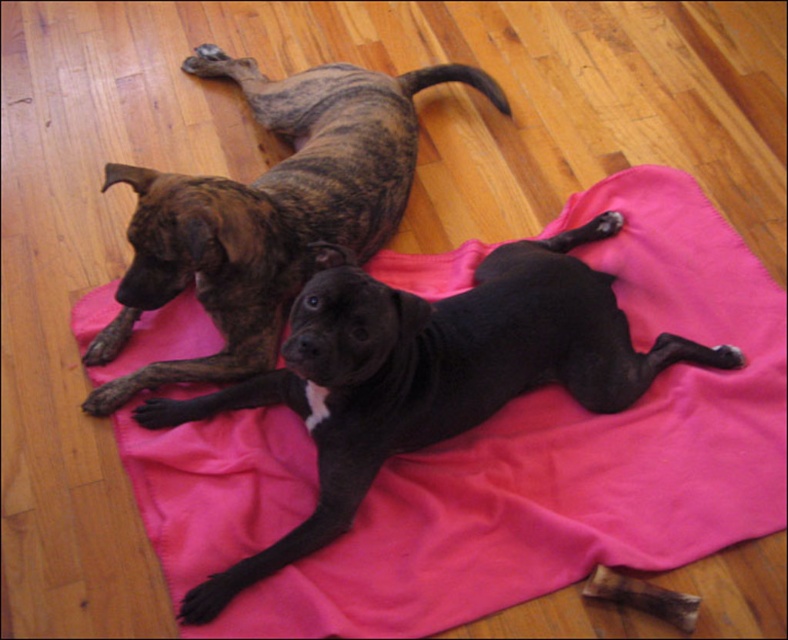
Question: Is black smooth dog at center above brindle fur dog at upper left?

Choices:
 (A) yes
 (B) no

Answer: (B)

Question: Which of the following is the closest to the observer?

Choices:
 (A) (484, 364)
 (B) (292, 83)

Answer: (A)

Question: Is black smooth dog at center wider than brindle fur dog at upper left?

Choices:
 (A) yes
 (B) no

Answer: (A)

Question: Is black smooth dog at center smaller than brindle fur dog at upper left?

Choices:
 (A) no
 (B) yes

Answer: (A)